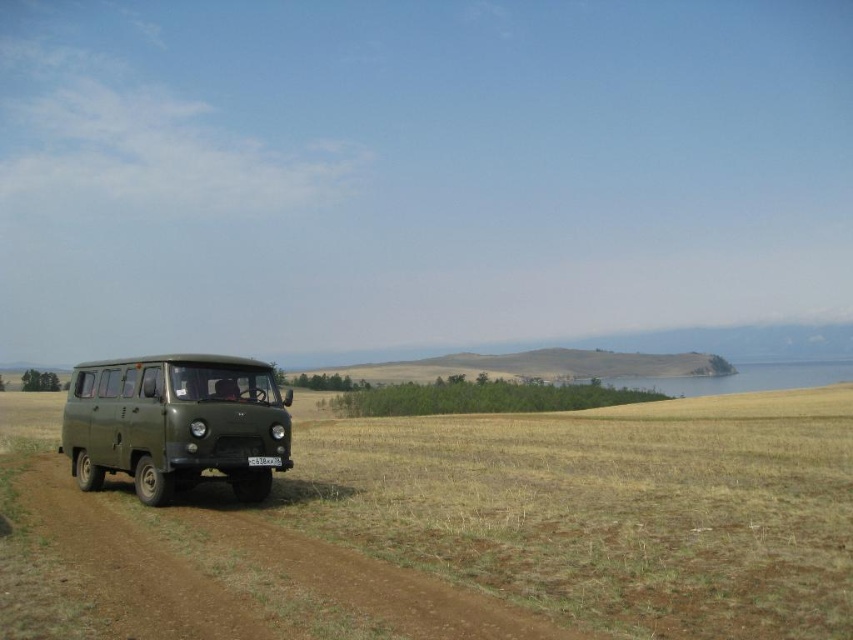
Is matte green van at left closer to the viewer compared to black plastic license plate at center?

Yes, matte green van at left is closer to the viewer.

Does matte green van at left appear on the right side of black plastic license plate at center?

Incorrect, matte green van at left is not on the right side of black plastic license plate at center.

Describe the element at coordinates (175, 422) in the screenshot. This screenshot has height=640, width=853. I see `matte green van at left` at that location.

Where is `matte green van at left`? The image size is (853, 640). matte green van at left is located at coordinates (175, 422).

Find the location of a particular element. brown dirt track at lower left is located at coordinates (247, 573).

Who is positioned more to the right, brown dirt track at lower left or black plastic license plate at center?

black plastic license plate at center

Locate an element on the screen. Image resolution: width=853 pixels, height=640 pixels. brown dirt track at lower left is located at coordinates (247, 573).

Is brown dirt track at lower left thinner than matte green van at left?

Incorrect, brown dirt track at lower left's width is not less than matte green van at left's.

Who is shorter, brown dirt track at lower left or matte green van at left?

Standing shorter between the two is brown dirt track at lower left.

Does point (222, 588) lie behind point (248, 372)?

No, it is not.

Image resolution: width=853 pixels, height=640 pixels. I want to click on brown dirt track at lower left, so click(x=247, y=573).